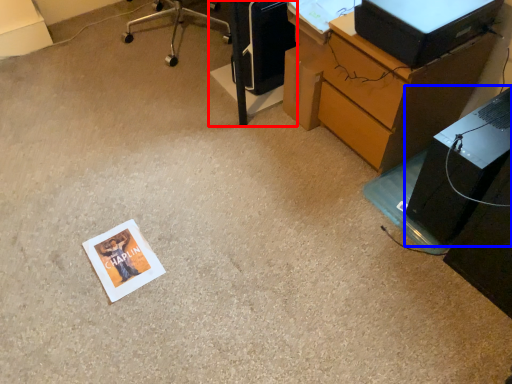
Question: Which object appears farthest to the camera in this image, furniture (highlighted by a red box) or computer tower (highlighted by a blue box)?

Choices:
 (A) furniture
 (B) computer tower

Answer: (A)